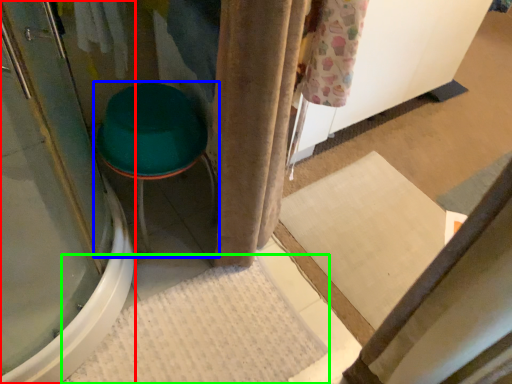
Question: Which object is the closest to the screen door (highlighted by a red box)? Choose among these: furniture (highlighted by a blue box) or bath mat (highlighted by a green box).

Choices:
 (A) furniture
 (B) bath mat

Answer: (A)